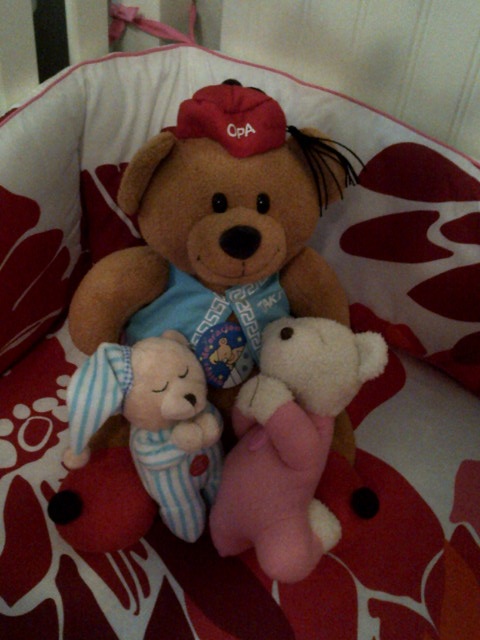
The height and width of the screenshot is (640, 480). I want to click on brown teddy bear, so click(187, 159).